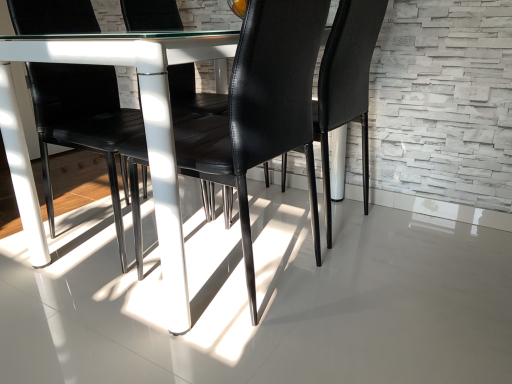
This screenshot has width=512, height=384. I want to click on free space to the left of black leather chair at center, marked as the first chair in a front-to-back arrangement, so click(x=61, y=316).